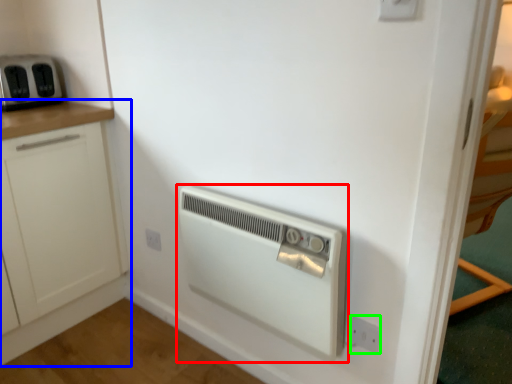
Question: Which is farther away from home appliance (highlighted by a red box)? cabinetry (highlighted by a blue box) or electric outlet (highlighted by a green box)?

Choices:
 (A) cabinetry
 (B) electric outlet

Answer: (A)